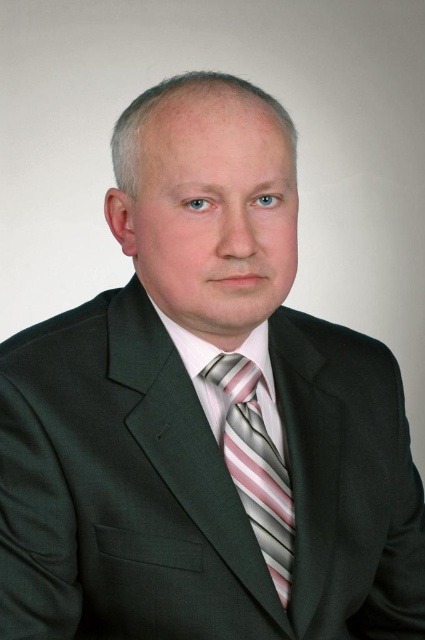
Is point (269, 541) more distant than point (203, 388)?

No, it is not.

Can you confirm if striped silk tie at center is positioned above pink striped dress shirt at center?

→ No.

Which is behind, point (272, 516) or point (221, 394)?

Positioned behind is point (221, 394).

Where is `striped silk tie at center`? striped silk tie at center is located at coordinates (255, 465).